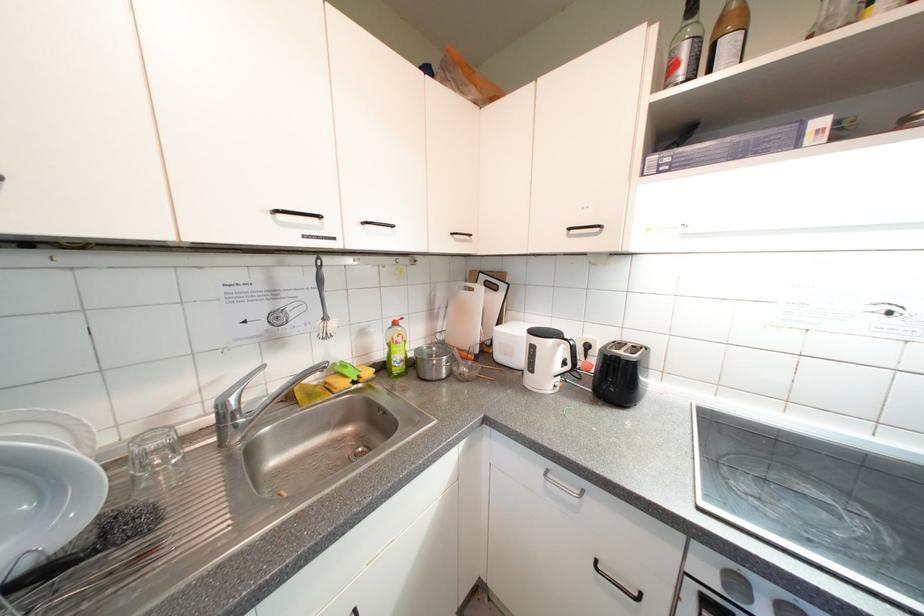
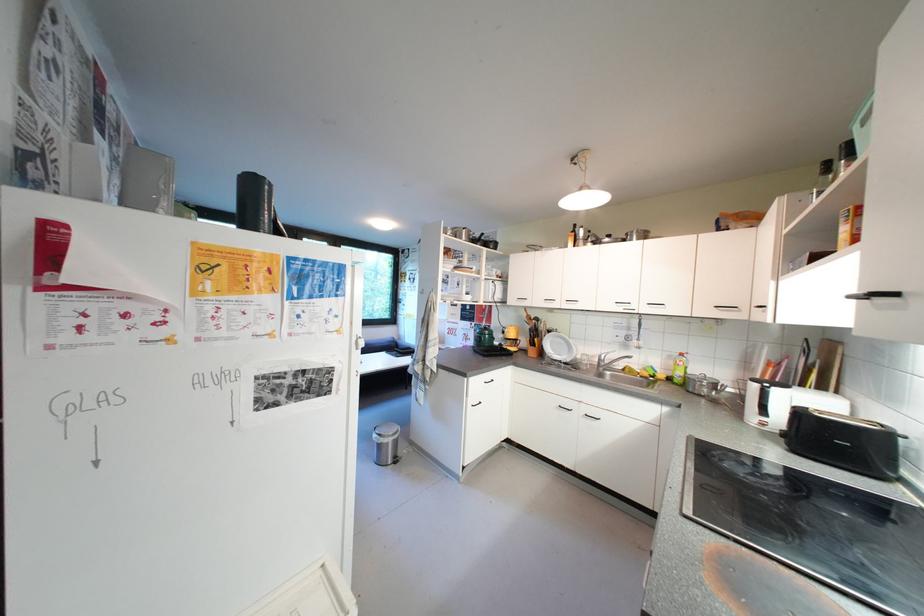
Locate, in the second image, the point that corresponds to the point at 373,225 in the first image.

(657, 306)